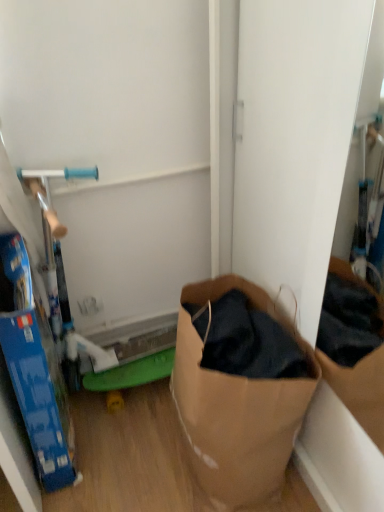
Question: Can you confirm if blue cardboard box at left is thinner than brown paper bag at lower right?

Choices:
 (A) yes
 (B) no

Answer: (A)

Question: From a real-world perspective, is blue cardboard box at left under brown paper bag at lower right?

Choices:
 (A) no
 (B) yes

Answer: (A)

Question: Can you confirm if blue cardboard box at left is wider than brown paper bag at lower right?

Choices:
 (A) yes
 (B) no

Answer: (B)

Question: Is blue cardboard box at left to the left of brown paper bag at lower right from the viewer's perspective?

Choices:
 (A) no
 (B) yes

Answer: (B)

Question: Is brown paper bag at lower right surrounded by blue cardboard box at left?

Choices:
 (A) yes
 (B) no

Answer: (B)

Question: Considering the relative sizes of blue cardboard box at left and brown paper bag at lower right in the image provided, is blue cardboard box at left smaller than brown paper bag at lower right?

Choices:
 (A) no
 (B) yes

Answer: (B)

Question: Could you tell me if brown paper bag at lower right is turned towards blue cardboard box at left?

Choices:
 (A) no
 (B) yes

Answer: (B)

Question: Is brown paper bag at lower right thinner than blue cardboard box at left?

Choices:
 (A) no
 (B) yes

Answer: (A)

Question: Can you confirm if brown paper bag at lower right is positioned to the left of blue cardboard box at left?

Choices:
 (A) no
 (B) yes

Answer: (A)

Question: Is blue cardboard box at left at the back of brown paper bag at lower right?

Choices:
 (A) no
 (B) yes

Answer: (A)

Question: Can you confirm if brown paper bag at lower right is positioned to the right of blue cardboard box at left?

Choices:
 (A) yes
 (B) no

Answer: (A)

Question: From a real-world perspective, is brown paper bag at lower right located beneath blue cardboard box at left?

Choices:
 (A) no
 (B) yes

Answer: (B)

Question: Is blue cardboard box at left wider or thinner than brown paper bag at lower right?

Choices:
 (A) wide
 (B) thin

Answer: (B)